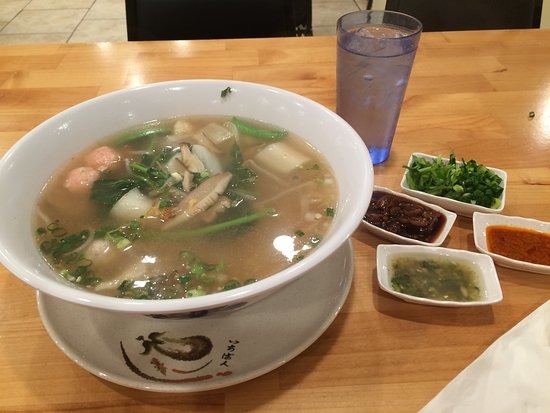
Locate an element on the screen. drinking glass is located at coordinates (382, 87), (385, 47).